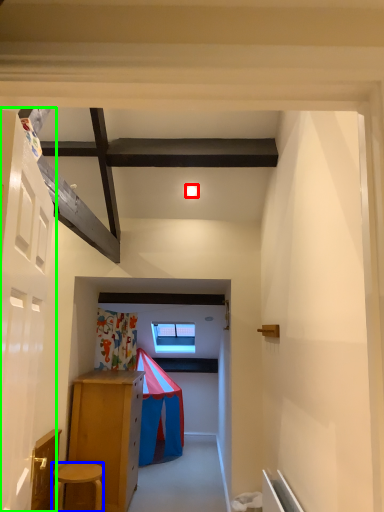
Question: Which is nearer to the light (highlighted by a red box)? stool (highlighted by a blue box) or door (highlighted by a green box).

Choices:
 (A) stool
 (B) door

Answer: (B)